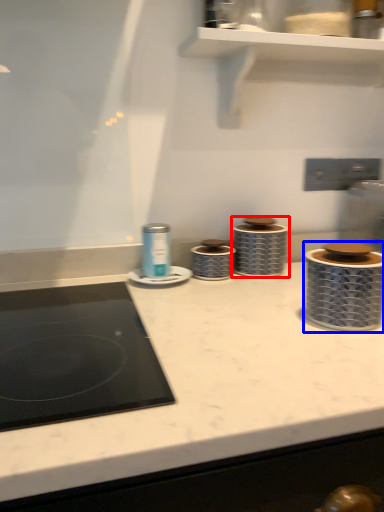
Question: Among these objects, which one is nearest to the camera, appliance (highlighted by a red box) or appliance (highlighted by a blue box)?

Choices:
 (A) appliance
 (B) appliance

Answer: (B)